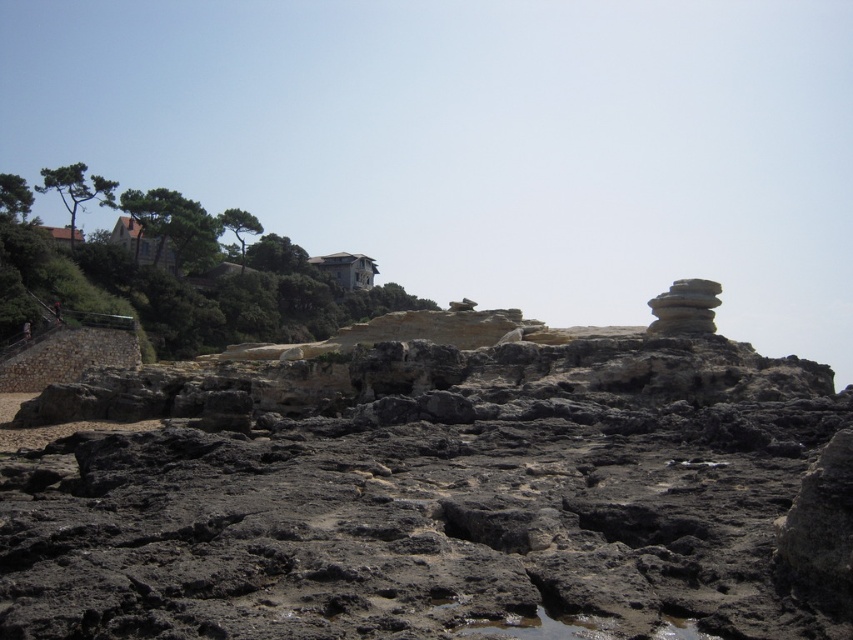
Question: Considering the relative positions of rough textured rock at center and smooth gray rock at upper right in the image provided, where is rough textured rock at center located with respect to smooth gray rock at upper right?

Choices:
 (A) left
 (B) right

Answer: (A)

Question: Is rough textured rock at center wider than smooth gray rock at upper right?

Choices:
 (A) yes
 (B) no

Answer: (A)

Question: Where is rough textured rock at center located in relation to smooth gray rock at upper right in the image?

Choices:
 (A) above
 (B) below

Answer: (B)

Question: Which of the following is the farthest from the observer?

Choices:
 (A) rough textured rock at center
 (B) smooth gray rock at upper right

Answer: (B)